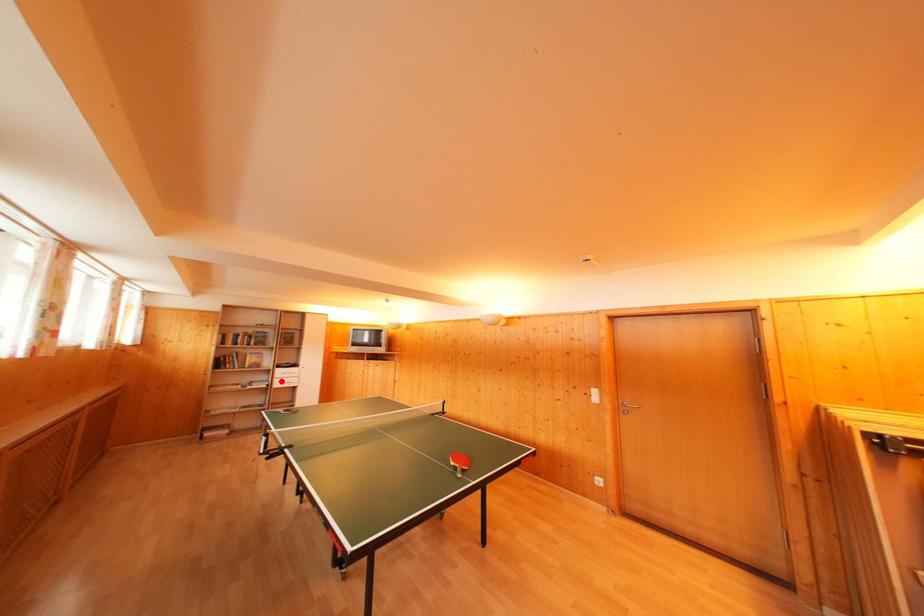
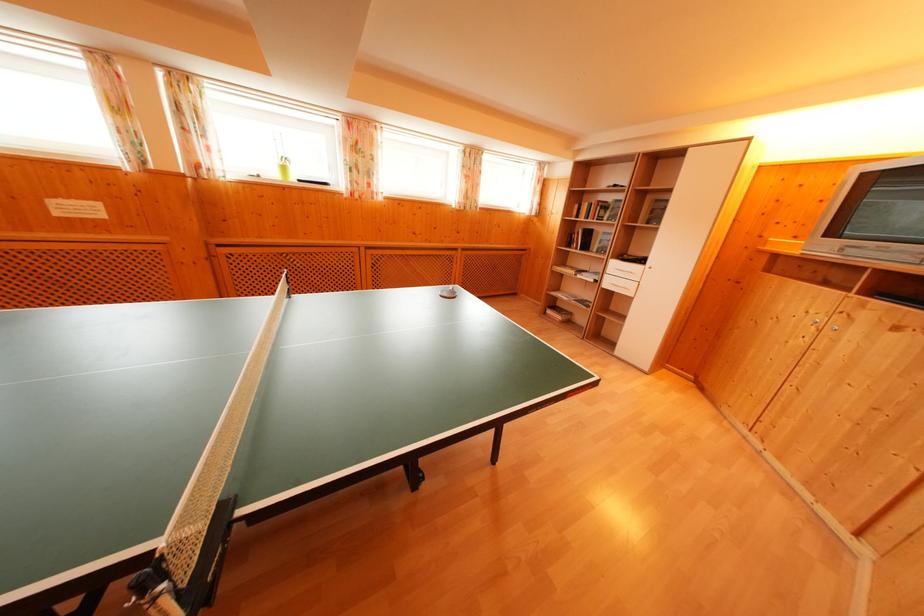
Question: I am providing you with two images of the same scene from different viewpoints. Given a red point in image1, look at the same physical point in image2. Is it:

Choices:
 (A) Closer to the viewpoint
 (B) Farther from the viewpoint

Answer: (A)